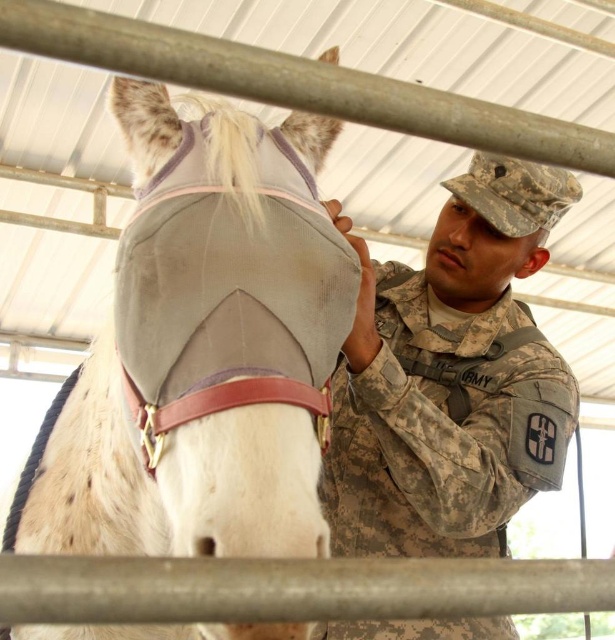
Is camouflage uniform at center to the right of camouflage fabric cap at upper right from the viewer's perspective?

No, camouflage uniform at center is not to the right of camouflage fabric cap at upper right.

Is camouflage uniform at center thinner than camouflage fabric cap at upper right?

No, camouflage uniform at center is not thinner than camouflage fabric cap at upper right.

Identify the location of camouflage uniform at center. (451, 381).

Which of these two, gray fabric horse mask at center or smooth skin nose at center, stands shorter?

With less height is smooth skin nose at center.

What do you see at coordinates (202, 349) in the screenshot?
I see `gray fabric horse mask at center` at bounding box center [202, 349].

The image size is (615, 640). What do you see at coordinates (202, 349) in the screenshot?
I see `gray fabric horse mask at center` at bounding box center [202, 349].

The width and height of the screenshot is (615, 640). I want to click on gray fabric horse mask at center, so click(x=202, y=349).

The image size is (615, 640). Identify the location of camouflage uniform at center. (451, 381).

Is the position of camouflage uniform at center less distant than that of smooth skin nose at center?

That is True.

Identify the location of camouflage uniform at center. (451, 381).